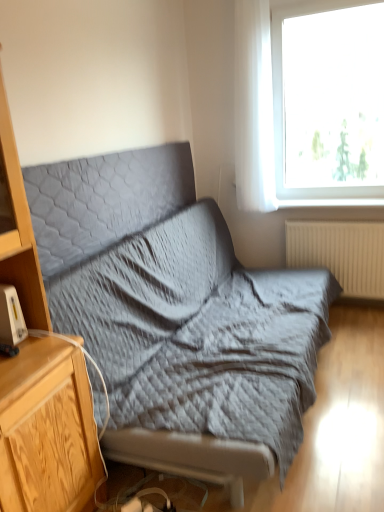
Question: From a real-world perspective, is white plastic gadget at left physically above beige ribbed radiator at lower right?

Choices:
 (A) no
 (B) yes

Answer: (B)

Question: Considering the relative sizes of white plastic gadget at left and beige ribbed radiator at lower right in the image provided, is white plastic gadget at left shorter than beige ribbed radiator at lower right?

Choices:
 (A) no
 (B) yes

Answer: (B)

Question: Is white plastic gadget at left located outside beige ribbed radiator at lower right?

Choices:
 (A) no
 (B) yes

Answer: (B)

Question: Does white plastic gadget at left have a larger size compared to beige ribbed radiator at lower right?

Choices:
 (A) no
 (B) yes

Answer: (A)

Question: Is white plastic gadget at left positioned with its back to beige ribbed radiator at lower right?

Choices:
 (A) yes
 (B) no

Answer: (B)

Question: Is transparent glass window at upper right inside the boundaries of textured gray fabric studio couch at center, or outside?

Choices:
 (A) outside
 (B) inside

Answer: (A)

Question: From a real-world perspective, is transparent glass window at upper right above or below textured gray fabric studio couch at center?

Choices:
 (A) below
 (B) above

Answer: (B)

Question: Is transparent glass window at upper right bigger or smaller than textured gray fabric studio couch at center?

Choices:
 (A) big
 (B) small

Answer: (B)

Question: Is transparent glass window at upper right in front of or behind textured gray fabric studio couch at center in the image?

Choices:
 (A) front
 (B) behind

Answer: (B)

Question: In terms of size, does gray quilted pillow at upper center appear bigger or smaller than beige ribbed radiator at lower right?

Choices:
 (A) big
 (B) small

Answer: (A)

Question: Based on their positions, is gray quilted pillow at upper center located to the left or right of beige ribbed radiator at lower right?

Choices:
 (A) right
 (B) left

Answer: (B)

Question: Is gray quilted pillow at upper center inside the boundaries of beige ribbed radiator at lower right, or outside?

Choices:
 (A) inside
 (B) outside

Answer: (B)

Question: Is gray quilted pillow at upper center taller or shorter than beige ribbed radiator at lower right?

Choices:
 (A) tall
 (B) short

Answer: (B)

Question: Relative to wooden cabinet at left, is textured gray fabric studio couch at center in front or behind?

Choices:
 (A) front
 (B) behind

Answer: (B)

Question: Considering the positions of textured gray fabric studio couch at center and wooden cabinet at left in the image, is textured gray fabric studio couch at center bigger or smaller than wooden cabinet at left?

Choices:
 (A) small
 (B) big

Answer: (B)